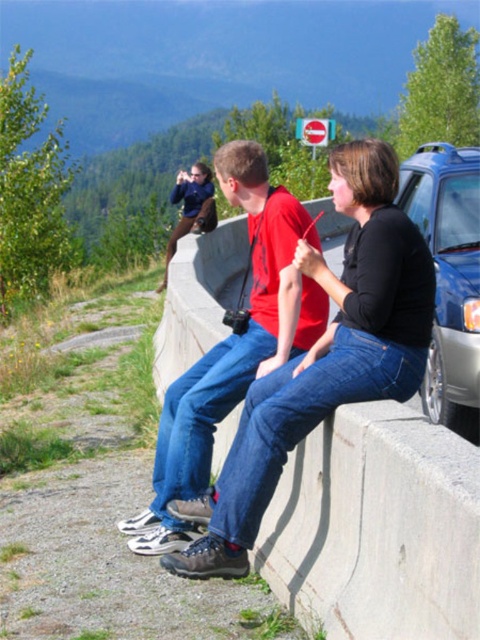
Question: Among these points, which one is farthest from the camera?

Choices:
 (A) (320, 227)
 (B) (172, 196)
 (C) (296, 243)

Answer: (A)

Question: Which object is positioned farthest from the matte black jacket at upper center?

Choices:
 (A) red cotton shirt at center
 (B) satin blue car at right
 (C) concrete at center

Answer: (A)

Question: Is the position of concrete at center more distant than that of matte black jacket at upper center?

Choices:
 (A) no
 (B) yes

Answer: (A)

Question: Among these points, which one is nearest to the camera?

Choices:
 (A) (411, 179)
 (B) (184, 189)

Answer: (A)

Question: Can you confirm if concrete at center is positioned below matte black jacket at upper center?

Choices:
 (A) yes
 (B) no

Answer: (A)

Question: In this image, where is satin blue car at right located relative to matte black jacket at upper center?

Choices:
 (A) left
 (B) right

Answer: (B)